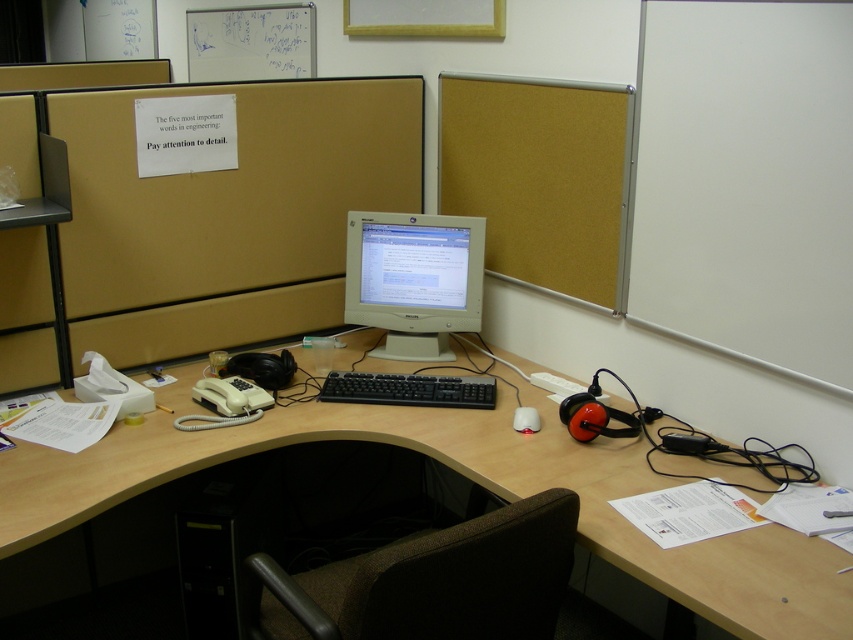
You are sitting in the brown fabric swivel chair at lower center and want to click the left button of the white matte mouse at center. Can you reach it without moving your chair?

The brown fabric swivel chair at lower center is positioned under the white matte mouse at center, so yes, you can easily reach the mouse to click its left button without moving the chair.

You are an office worker who needs to move the white matte mouse at center to the right side of the desk. Can you move the brown fabric swivel chair at lower center out of the way to make space?

The brown fabric swivel chair at lower center might be wider than the white matte mouse at center, so moving the chair could create enough space to move the mouse to the right side of the desk.